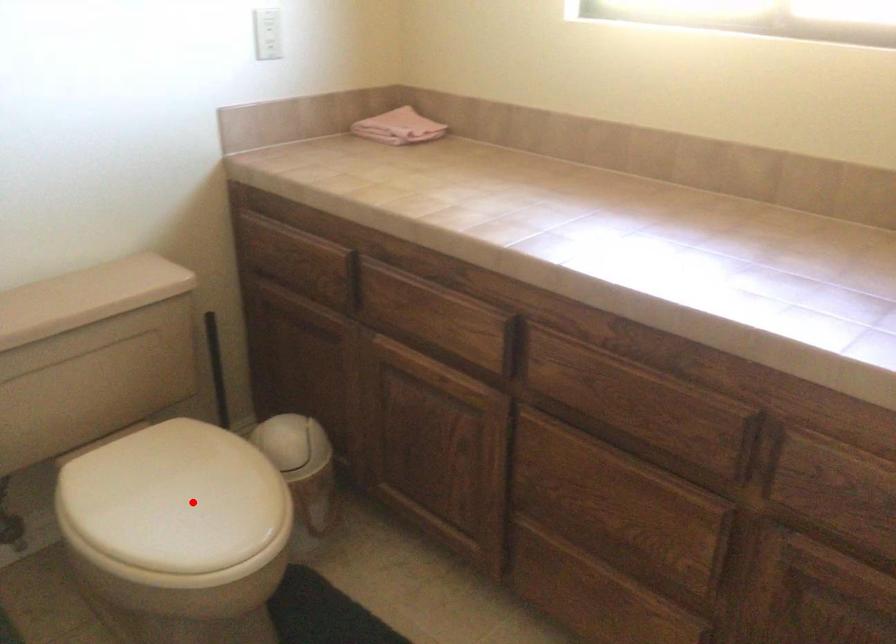
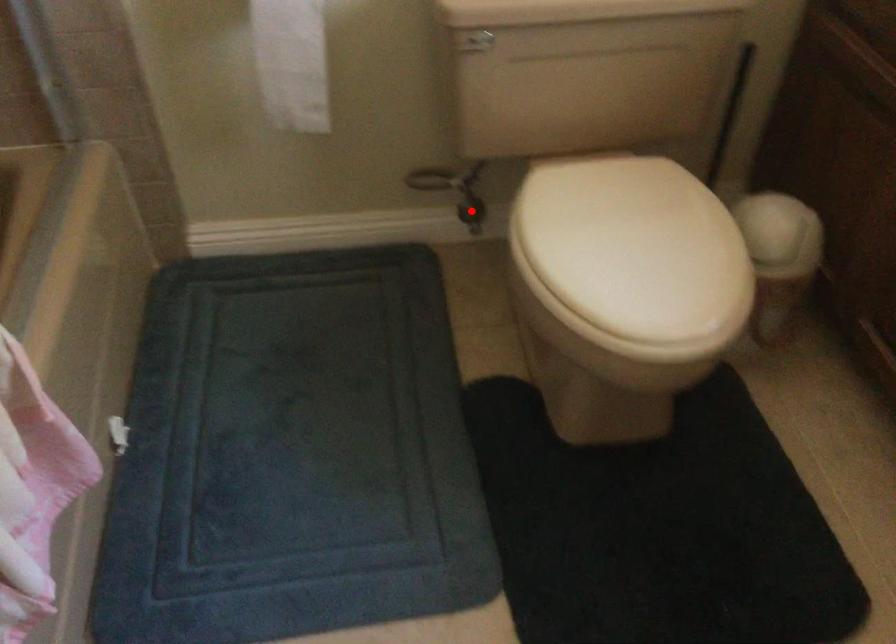
I am providing you with two images of the same scene from different viewpoints. A red point is marked on the first image and another point is marked on the second image. Is the marked point in image1 the same physical position as the marked point in image2?

No